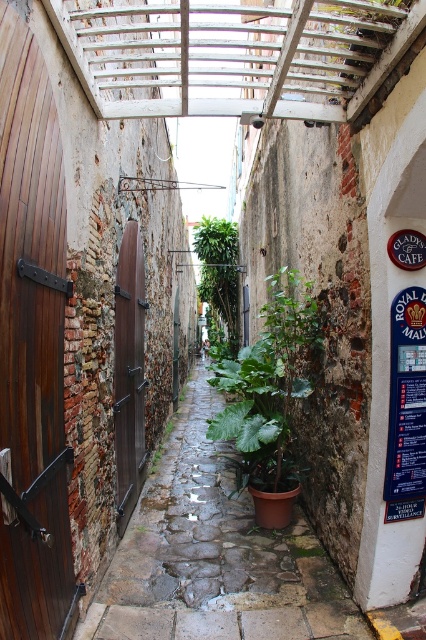
Question: Is wooden door at left closer to camera compared to green leafy plant at center?

Choices:
 (A) no
 (B) yes

Answer: (B)

Question: Is wooden door at left further to camera compared to brown stone path at center?

Choices:
 (A) yes
 (B) no

Answer: (B)

Question: Which point is farther from the camera taking this photo?

Choices:
 (A) (273, 403)
 (B) (250, 637)
 (C) (196, 253)

Answer: (C)

Question: Which point is closer to the camera?

Choices:
 (A) green leafy plant at center
 (B) brown wooden door at left

Answer: (B)

Question: Does brown wooden door at left have a lesser width compared to green leafy plant at center?

Choices:
 (A) yes
 (B) no

Answer: (A)

Question: Which point is farther to the camera?

Choices:
 (A) (40, 618)
 (B) (294, 620)

Answer: (B)